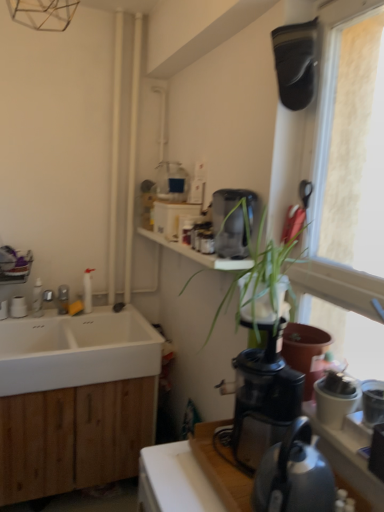
Question: Choose the correct answer: Is green leafy plant at upper right inside black plastic coffee maker at center-right, positioned as the 1th coffee maker in front-to-back order, or outside it?

Choices:
 (A) outside
 (B) inside

Answer: (A)

Question: In terms of width, does green leafy plant at upper right look wider or thinner when compared to black plastic coffee maker at center-right, positioned as the 1th coffee maker in front-to-back order?

Choices:
 (A) thin
 (B) wide

Answer: (B)

Question: Which object is the closest to the black plastic coffee maker at center-right, which is the 2th coffee maker in back-to-front order?

Choices:
 (A) brushed metal faucet at left
 (B) transparent plastic window at upper right
 (C) white matte sink at lower left
 (D) wooden countertop at lower right
 (E) satin black coffee maker at upper center, acting as the 2th coffee maker starting from the bottom

Answer: (D)

Question: Based on their relative distances, which object is farther from the metallic gray kettle at lower right?

Choices:
 (A) green leafy plant at upper right
 (B) wooden countertop at lower right
 (C) white matte sink at lower left
 (D) black plastic coffee maker at center-right, positioned as the 1th coffee maker in front-to-back order
 (E) satin black coffee maker at upper center, which is counted as the 1th coffee maker, starting from the top

Answer: (C)